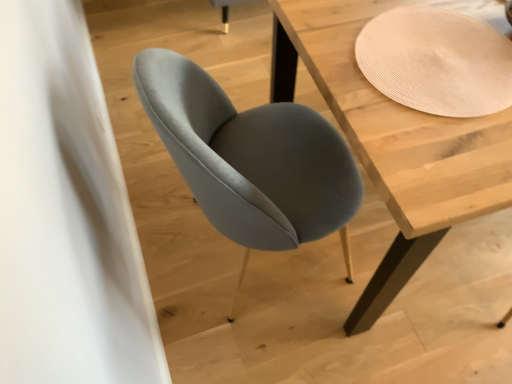
Question: In the image, is light wood table at center positioned in front of or behind suede gray chair at center?

Choices:
 (A) front
 (B) behind

Answer: (B)

Question: Choose the correct answer: Is light wood table at center inside suede gray chair at center or outside it?

Choices:
 (A) inside
 (B) outside

Answer: (B)

Question: From the image's perspective, is light wood table at center located above or below suede gray chair at center?

Choices:
 (A) above
 (B) below

Answer: (A)

Question: In terms of height, does suede gray chair at center look taller or shorter compared to light wood table at center?

Choices:
 (A) short
 (B) tall

Answer: (B)

Question: Is suede gray chair at center in front of or behind light wood table at center in the image?

Choices:
 (A) front
 (B) behind

Answer: (A)

Question: From a real-world perspective, relative to light wood table at center, is suede gray chair at center vertically above or below?

Choices:
 (A) above
 (B) below

Answer: (A)

Question: Does point (190, 87) appear closer or farther from the camera than point (442, 157)?

Choices:
 (A) farther
 (B) closer

Answer: (A)